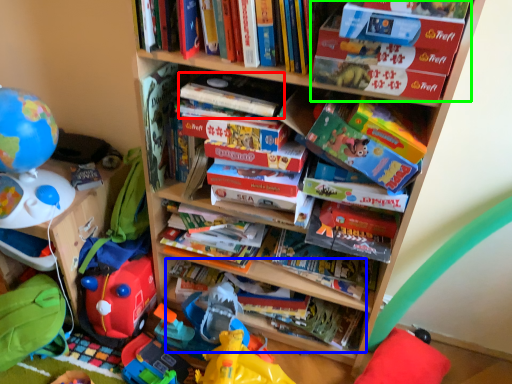
Question: Which is farther away from paperback book (highlighted by a red box)? book (highlighted by a blue box) or book (highlighted by a green box)?

Choices:
 (A) book
 (B) book

Answer: (A)